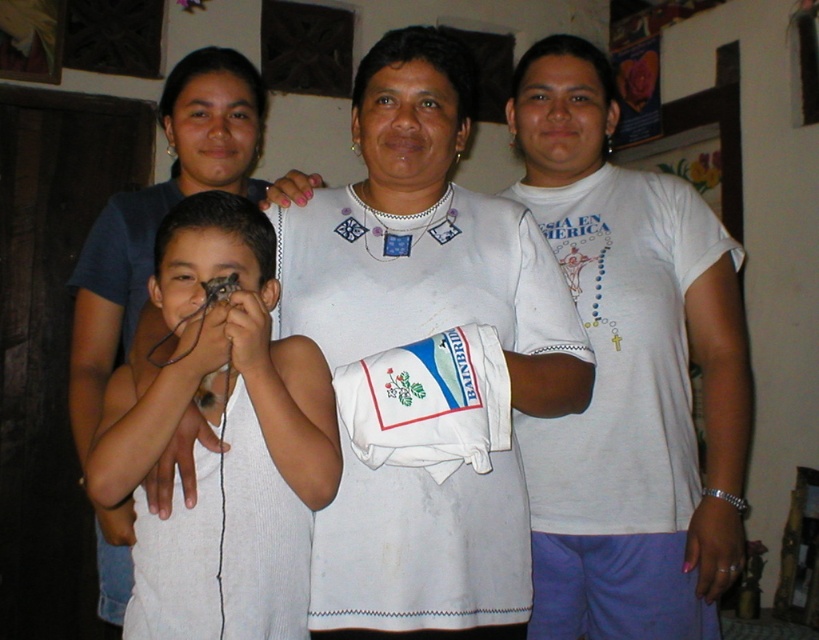
Looking at the scene, which clothing item is taller between the white embroidered dress at center and the white knitted tank top at center?

The white embroidered dress at center is taller than the white knitted tank top at center.

You are a photographer trying to capture the woman in the center. You notice she is wearing two white tops. Which one is visible on top, the white cotton shirt at center or the white knitted tank top at center?

The white cotton shirt at center is visible on top as it is positioned above the white knitted tank top at center.